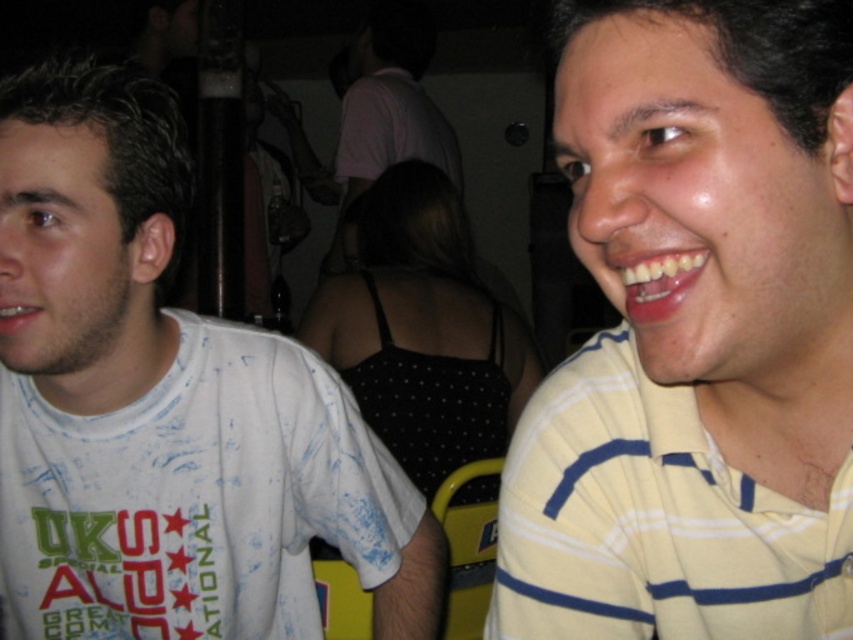
Question: Which point is farther to the camera?

Choices:
 (A) (675, 298)
 (B) (21, 317)
 (C) (402, 104)

Answer: (C)

Question: Which of the following is the closest to the observer?

Choices:
 (A) coord(273,531)
 (B) coord(381,1)

Answer: (A)

Question: Can you confirm if white printed t-shirt at left is positioned below white glossy teeth at lower left?

Choices:
 (A) no
 (B) yes

Answer: (B)

Question: Is white printed t-shirt at left thinner than white matte shirt at center?

Choices:
 (A) yes
 (B) no

Answer: (A)

Question: Among these points, which one is farthest from the camera?

Choices:
 (A) (19, 305)
 (B) (686, 280)

Answer: (A)

Question: Can you confirm if glossy white teeth at center is positioned to the left of white glossy teeth at lower left?

Choices:
 (A) no
 (B) yes

Answer: (A)